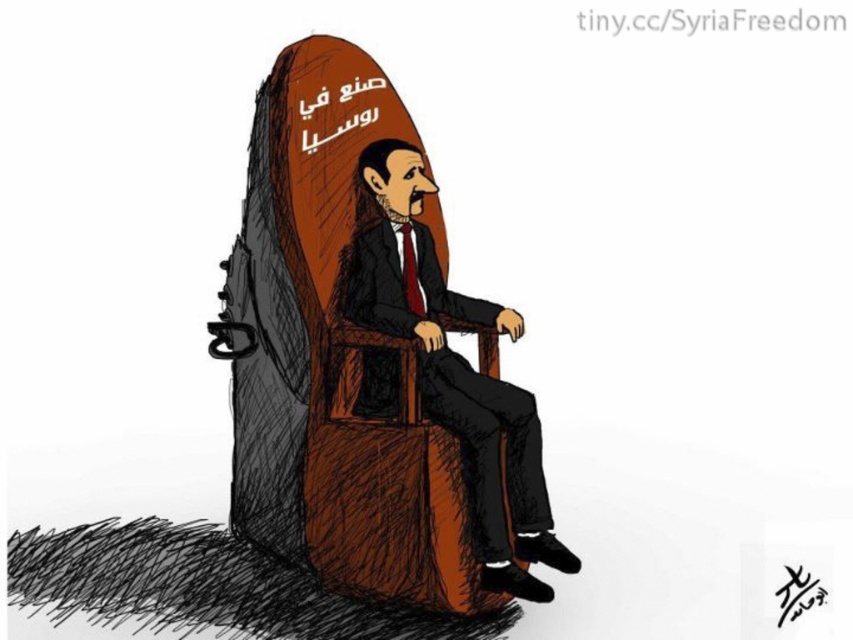
You are an art student analyzing this political cartoon. You notice the brown wooden armchair at center and the black ink signature at center. Which object is located to the right of the other?

The brown wooden armchair at center is positioned on the left side of black ink signature at center, so the black ink signature at center is to the right of the brown wooden armchair at center.

Consider the image. You are an art analyst examining this political cartoon. You notice the smooth brown chair at center and the black ink signature at center. Based on their positions, which object is closer to the viewer?

The smooth brown chair at center is closer to the viewer than the black ink signature at center because it is positioned in front of it.